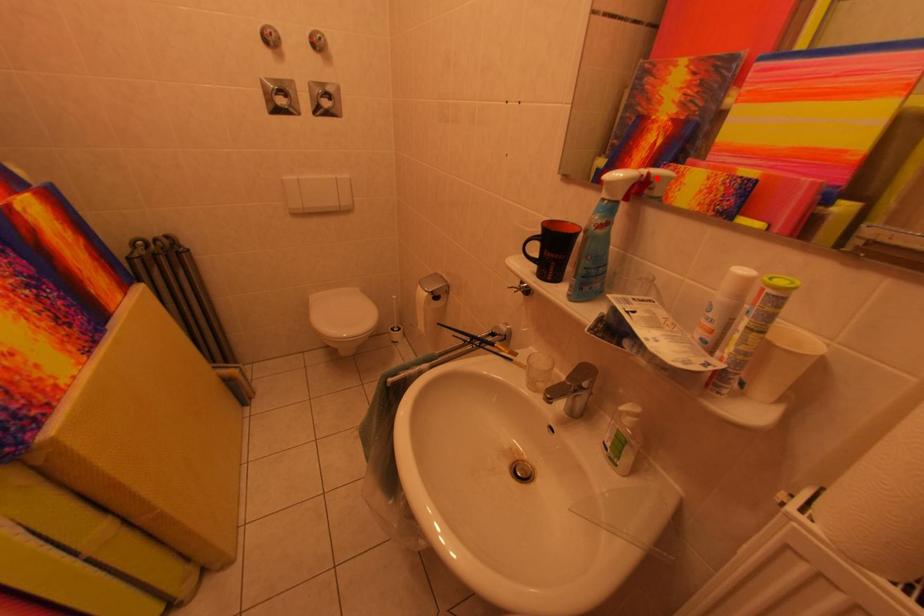
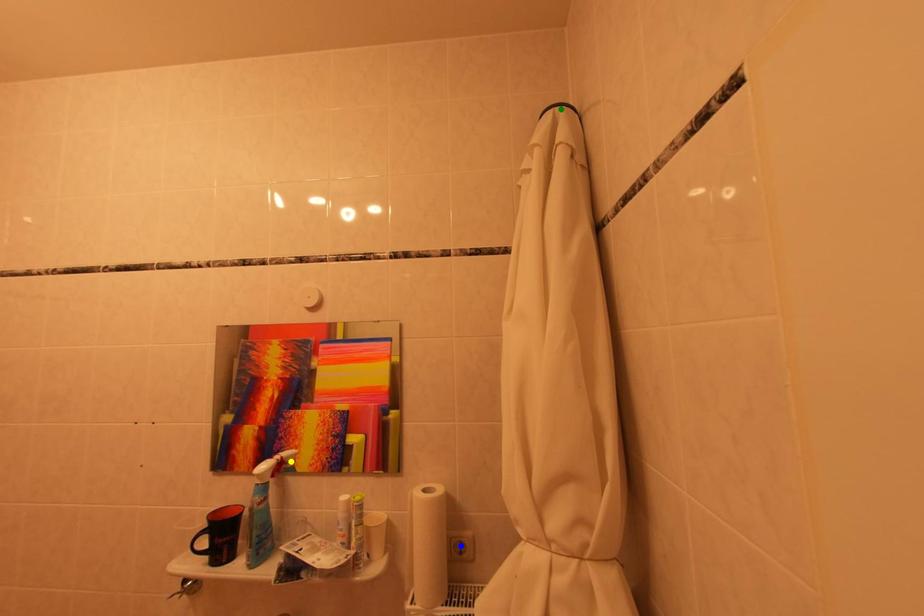
Question: I am providing you with two images of the same scene from different viewpoints. A red point is marked on the first image. You are given multiple points on the second image. Which spot in image 2 lines up with the point in image 1?

Choices:
 (A) yellow point
 (B) blue point
 (C) green point

Answer: (A)